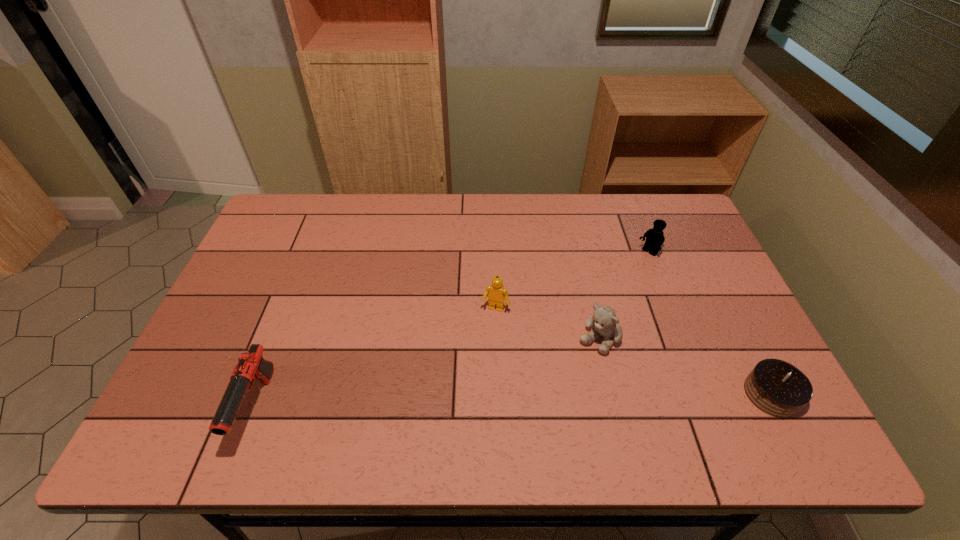
This screenshot has width=960, height=540. In order to click on the second closest object relative to the fourth nearest object in this screenshot , I will do click(x=655, y=238).

What are the coordinates of `object that stands as the second closest to the left Lego` in the screenshot? It's located at (655, 238).

The width and height of the screenshot is (960, 540). Find the location of `blank space that satisfies the following two spatial constraints: 1. on the front side of the chocolate cake; 2. on the right side of the fourth object from right to left`. blank space that satisfies the following two spatial constraints: 1. on the front side of the chocolate cake; 2. on the right side of the fourth object from right to left is located at coordinates (497, 394).

Locate an element on the screen. vacant region that satisfies the following two spatial constraints: 1. on the back side of the left Lego; 2. on the left side of the second object from right to left is located at coordinates (493, 253).

The height and width of the screenshot is (540, 960). I want to click on free space that satisfies the following two spatial constraints: 1. on the back side of the fourth object from left to right; 2. on the right side of the second farthest object, so click(493, 253).

Image resolution: width=960 pixels, height=540 pixels. Find the location of `free space in the image that satisfies the following two spatial constraints: 1. on the back side of the teddy bear; 2. on the left side of the farther Lego`. free space in the image that satisfies the following two spatial constraints: 1. on the back side of the teddy bear; 2. on the left side of the farther Lego is located at coordinates (579, 253).